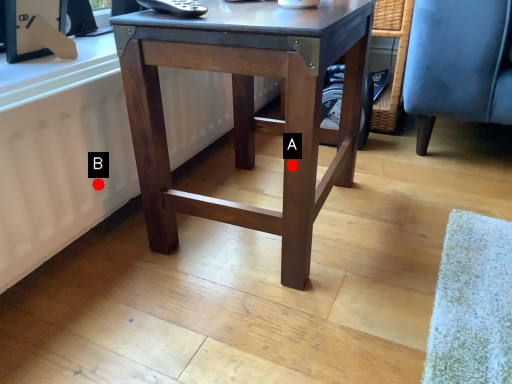
Question: Two points are circled on the image, labeled by A and B beside each circle. Which point is farther from the camera taking this photo?

Choices:
 (A) A is further
 (B) B is further

Answer: (B)